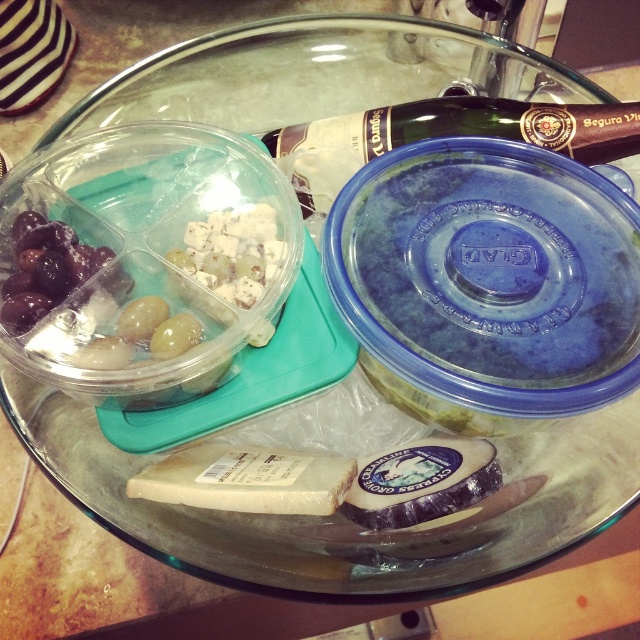
Question: Can you confirm if white creamy cheese at center is smaller than blue creamy cheese at center?

Choices:
 (A) yes
 (B) no

Answer: (B)

Question: Does blue plastic bowl at center appear over dark purple grapes at left?

Choices:
 (A) yes
 (B) no

Answer: (B)

Question: Considering the real-world distances, which object is closest to the white creamy cheese at center?

Choices:
 (A) dark purple grapes at left
 (B) blue plastic bowl at center
 (C) blue creamy cheese at center
 (D) translucent plastic container at center

Answer: (C)

Question: Among these objects, which one is farthest from the camera?

Choices:
 (A) dark purple grapes at left
 (B) blue plastic bowl at center

Answer: (A)

Question: Which object is closer to the camera taking this photo?

Choices:
 (A) blue plastic bowl at center
 (B) blue creamy cheese at center
 (C) translucent plastic container at center

Answer: (A)

Question: Considering the relative positions of translucent plastic container at center and dark purple grapes at left in the image provided, where is translucent plastic container at center located with respect to dark purple grapes at left?

Choices:
 (A) left
 (B) right

Answer: (B)